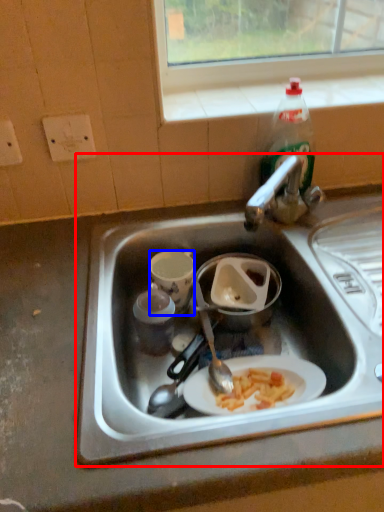
Question: Which point is closer to the camera, sink (highlighted by a red box) or coffee cup (highlighted by a blue box)?

Choices:
 (A) sink
 (B) coffee cup

Answer: (A)